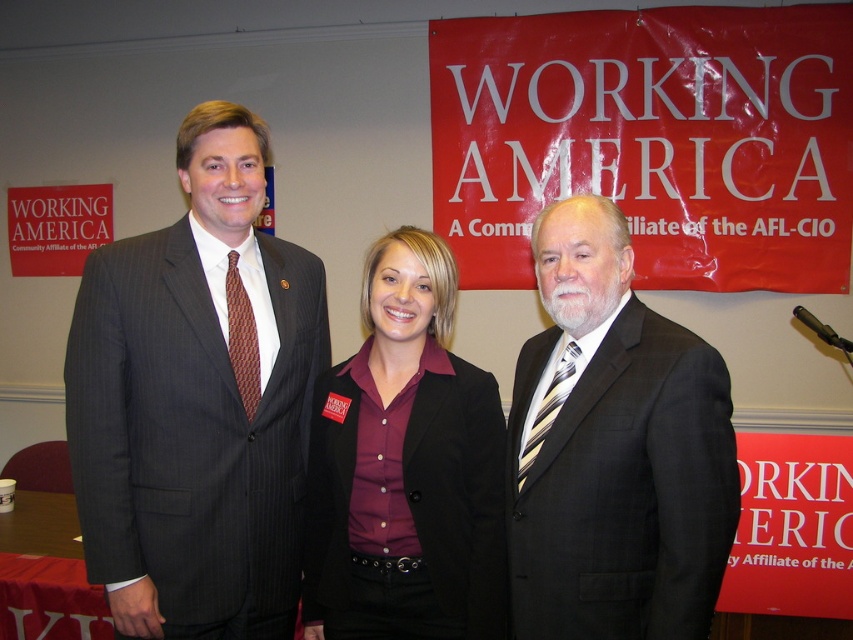
Question: Does gray pinstripe suit at center come behind matte black blazer at center?

Choices:
 (A) yes
 (B) no

Answer: (B)

Question: Does matte black blazer at center come in front of striped silk tie at right?

Choices:
 (A) no
 (B) yes

Answer: (A)

Question: Which object is closer to the camera taking this photo?

Choices:
 (A) gray pinstripe suit at center
 (B) striped silk tie at right

Answer: (B)

Question: Which object is farther from the camera taking this photo?

Choices:
 (A) matte black suit at left
 (B) striped silk tie at right
 (C) brown woven tie at left
 (D) gray pinstripe suit at center

Answer: (C)

Question: Does matte black suit at left appear on the right side of brown woven tie at left?

Choices:
 (A) no
 (B) yes

Answer: (B)

Question: Based on their relative distances, which object is farther from the matte black blazer at center?

Choices:
 (A) gray pinstripe suit at center
 (B) striped silk tie at right
 (C) matte black suit at left

Answer: (B)